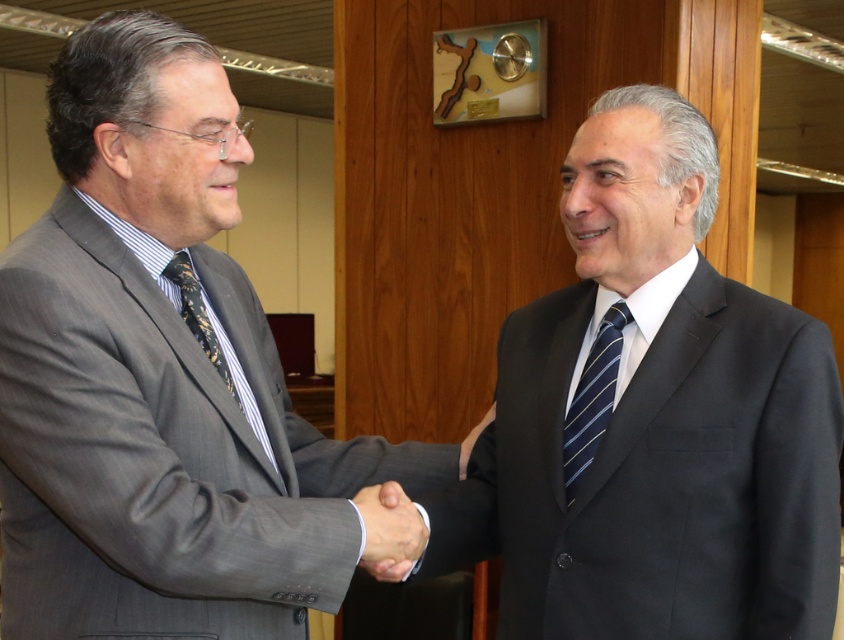
You are a photographer positioned in front of the two men. You want to capture a photo where the matte gray suit at center is clearly visible without being obscured by the blue striped tie at center. Should you adjust your camera position forward or backward to achieve this?

The matte gray suit at center is behind the blue striped tie at center. To prevent the blue striped tie at center from obscuring the matte gray suit at center, you should move your camera position backward to create more distance between the two subjects, allowing the matte gray suit at center to be seen clearly.

You are a photographer in an office setting. You need to capture a photo of the black silk tie at left and the matte gray suit at center. Based on their positions, which object is closer to the camera?

The black silk tie at left is located above the matte gray suit at center, so it is closer to the camera.

You are a photographer in an office setting and need to capture a clear photo of both the dark gray suit at center and the matte gray suit at center. Since you can only focus on one subject at a time, which suit should you focus on to ensure the other is still somewhat in focus?

You should focus on the dark gray suit at center because it is closer to you than the matte gray suit at center. By focusing on the closer subject, the depth of field may still keep the matte gray suit at center somewhat in focus.